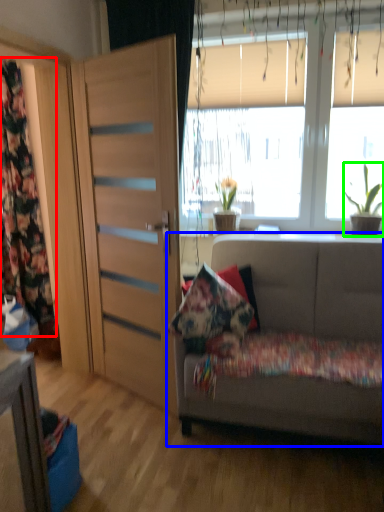
Question: Estimate the real-world distances between objects in this image. Which object is closer to curtain (highlighted by a red box), studio couch (highlighted by a blue box) or houseplant (highlighted by a green box)?

Choices:
 (A) studio couch
 (B) houseplant

Answer: (A)